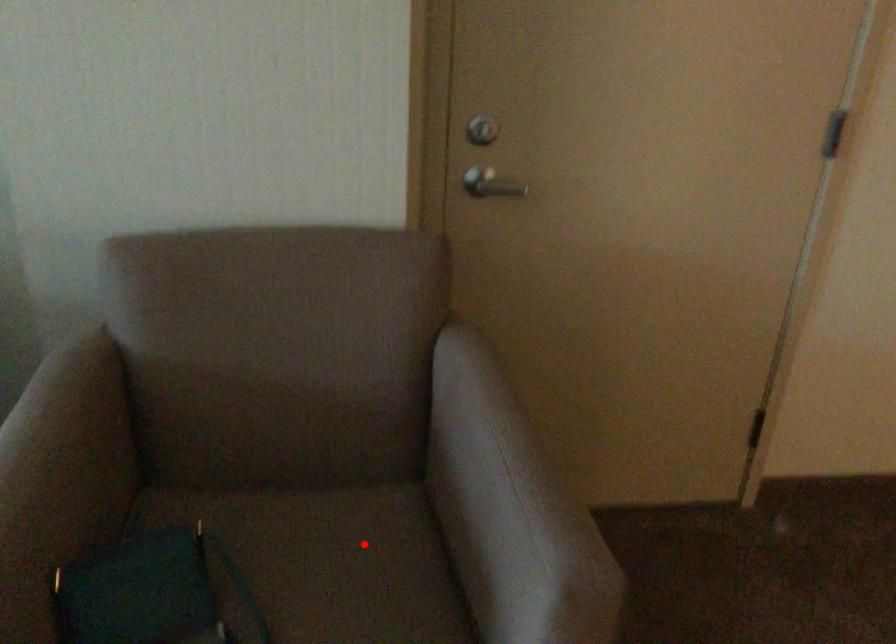
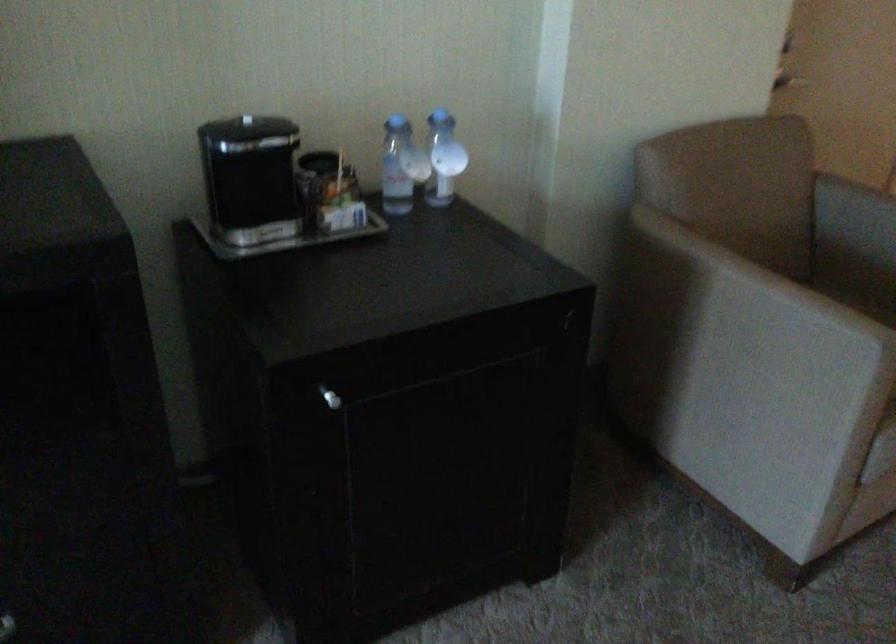
Question: A red point is marked in image1. In image2, is the corresponding 3D point closer to the camera or farther? Reply with the corresponding letter.

Choices:
 (A) The corresponding 3D point is closer.
 (B) The corresponding 3D point is farther.

Answer: (B)